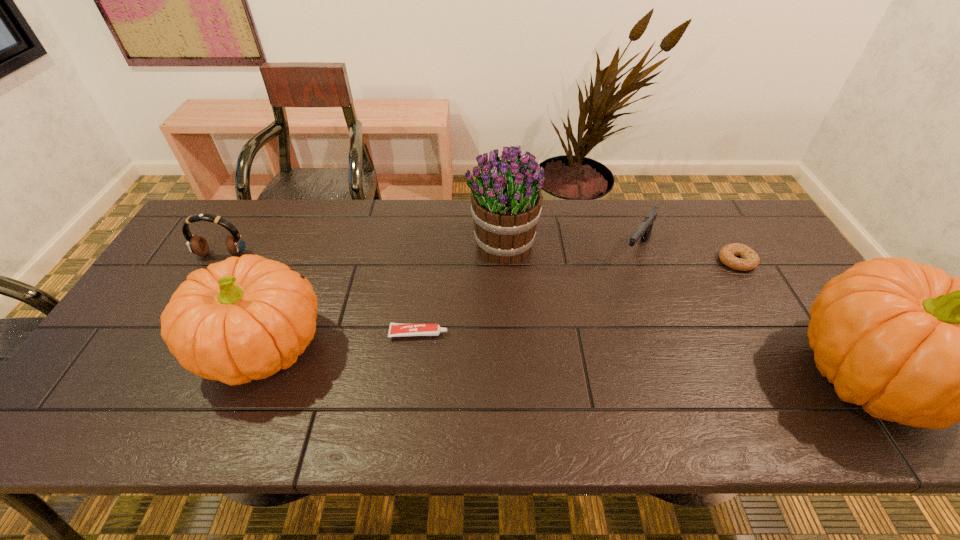
To achieve uniform spacing by inserting another pumpkin among them, please point to a free space for this new pumpkin. Please provide its 2D coordinates. Your answer should be formatted as a tuple, i.e. [(x, y)], where the tuple contains the x and y coordinates of a point satisfying the conditions above.

[(560, 360)]